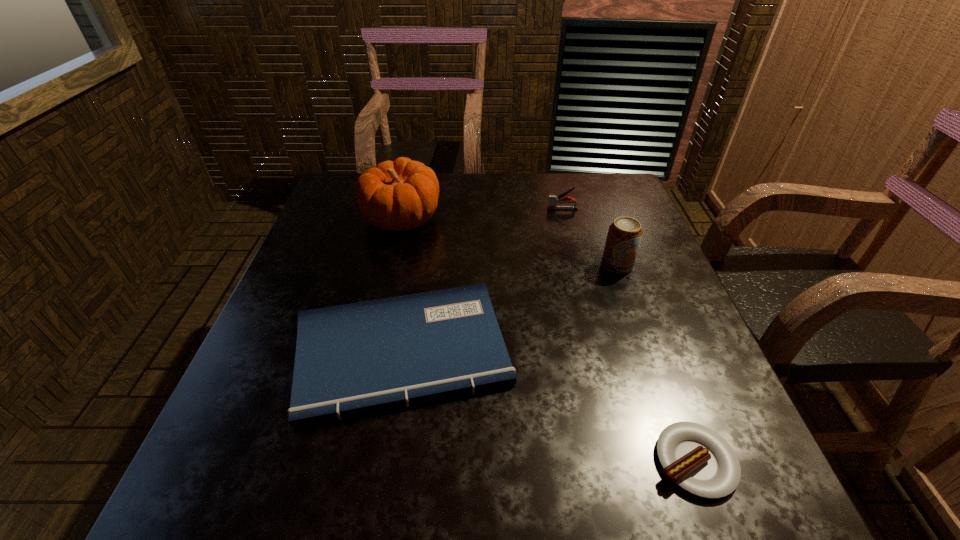
At what (x,y) coordinates should I click in order to perform the action: click on sausage that is at the right edge. Please return your answer as a coordinate pair (x, y). Looking at the image, I should click on click(x=696, y=458).

Identify the location of object that is positioned at the far left corner. The height and width of the screenshot is (540, 960). (400, 195).

Identify the location of object positioned at the near right corner. The image size is (960, 540). (696, 458).

Where is `vacant space at the far edge of the desktop`? Image resolution: width=960 pixels, height=540 pixels. vacant space at the far edge of the desktop is located at coordinates (502, 197).

The image size is (960, 540). In order to click on free location at the near edge of the desktop in this screenshot , I will do point(333,468).

At what (x,y) coordinates should I click in order to perform the action: click on free space at the left edge of the desktop. Please return your answer as a coordinate pair (x, y). Looking at the image, I should click on (322, 237).

Where is `vacant area at the right edge`? vacant area at the right edge is located at coordinates (662, 420).

Find the location of `vacant area at the far right corner of the desktop`. vacant area at the far right corner of the desktop is located at coordinates (599, 190).

Where is `empty space that is in between the pumpkin and the sausage`? This screenshot has width=960, height=540. empty space that is in between the pumpkin and the sausage is located at coordinates (547, 340).

Locate an element on the screen. This screenshot has height=540, width=960. free space between the sausage and the stapler is located at coordinates (629, 335).